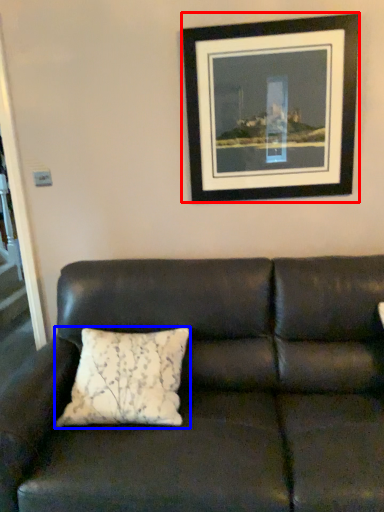
Question: Which object is closer to the camera taking this photo, picture frame (highlighted by a red box) or pillow (highlighted by a blue box)?

Choices:
 (A) picture frame
 (B) pillow

Answer: (B)